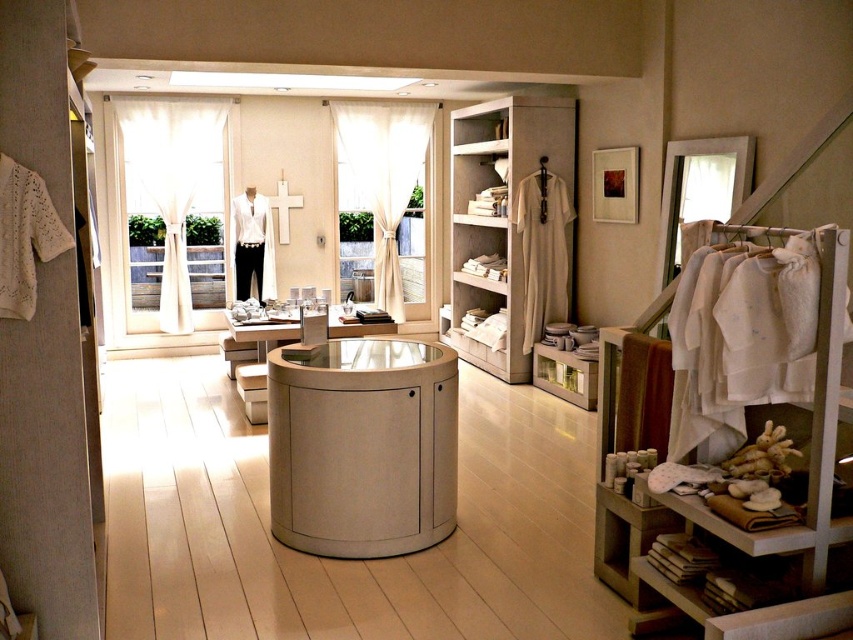
You are a customer in the store and want to place the light beige fabric robe at center on the beige fabric shelf at center right. Can you determine if the robe will fit on the shelf?

The beige fabric shelf at center right might be wider than light beige fabric robe at center, so there is a possibility that the robe can fit on the shelf. However, since the exact dimensions are not provided, it is recommended to check the actual size before placing the robe.